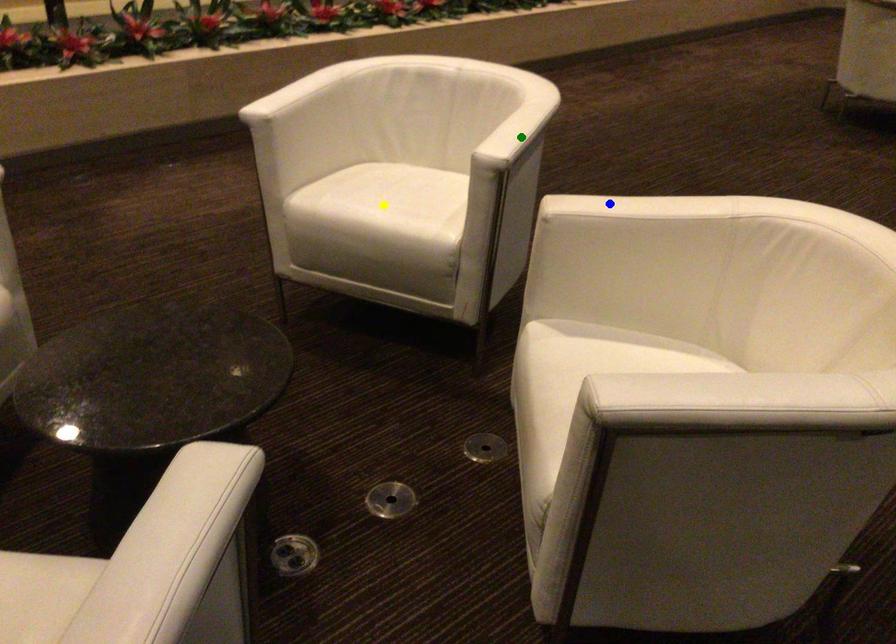
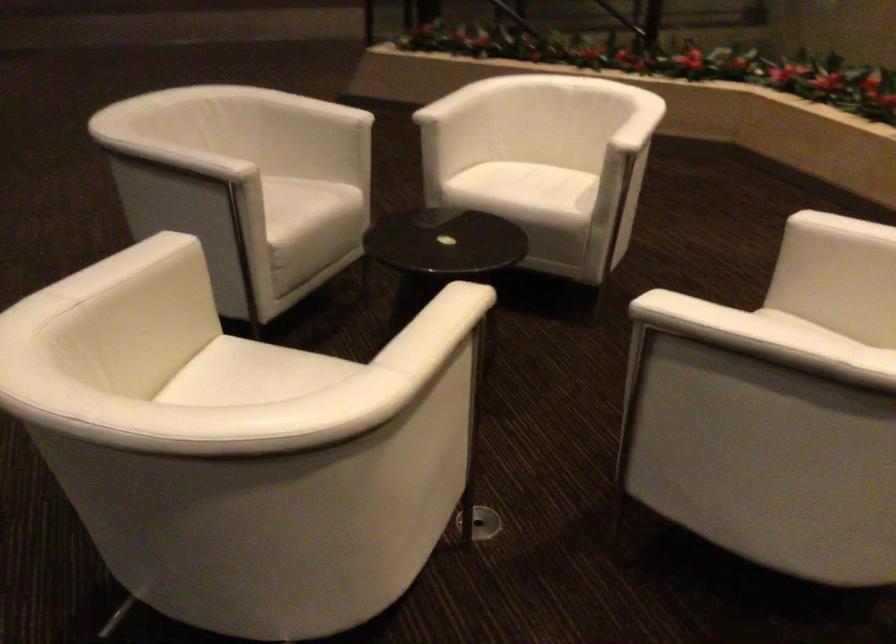
I am providing you with two images of the same scene from different viewpoints. Three points are marked in image1. Which point corresponds to a part or object that is occluded in image2?In image1, three points are marked. Which of them correspond to a part or object that is occluded in image2?Among the three points shown in image1, which one corresponds to a part or object that is no longer visible due to occlusion in image2?

yellow point cannot be seen in image2.